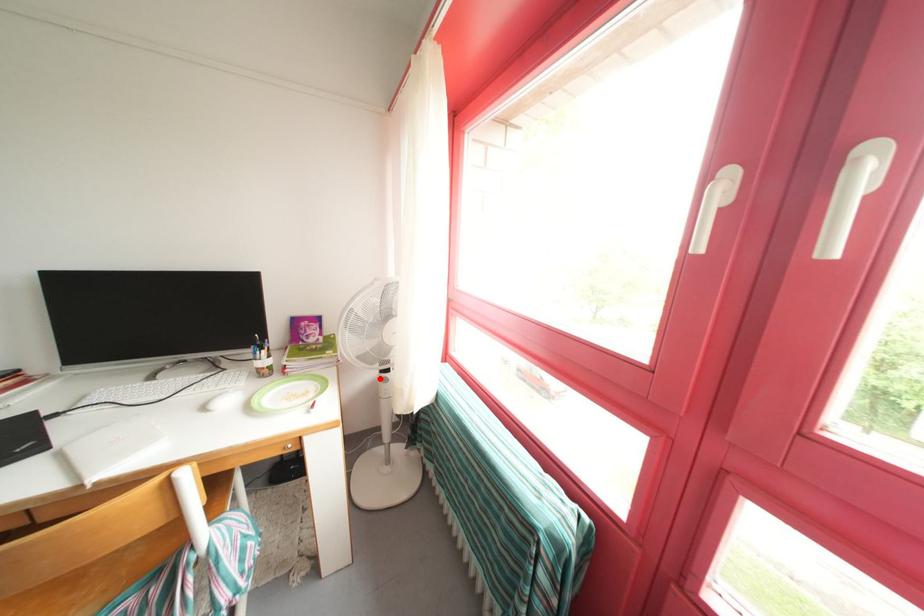
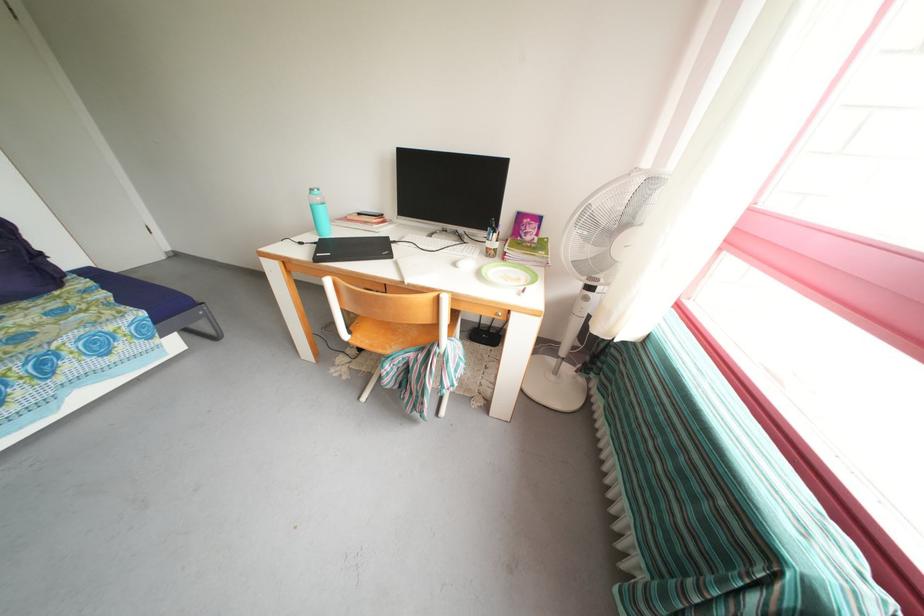
Question: I am providing you with two images of the same scene from different viewpoints. A red point is marked on the first image. Is the red point's position out of view in image 2?

Choices:
 (A) Yes
 (B) No

Answer: (B)